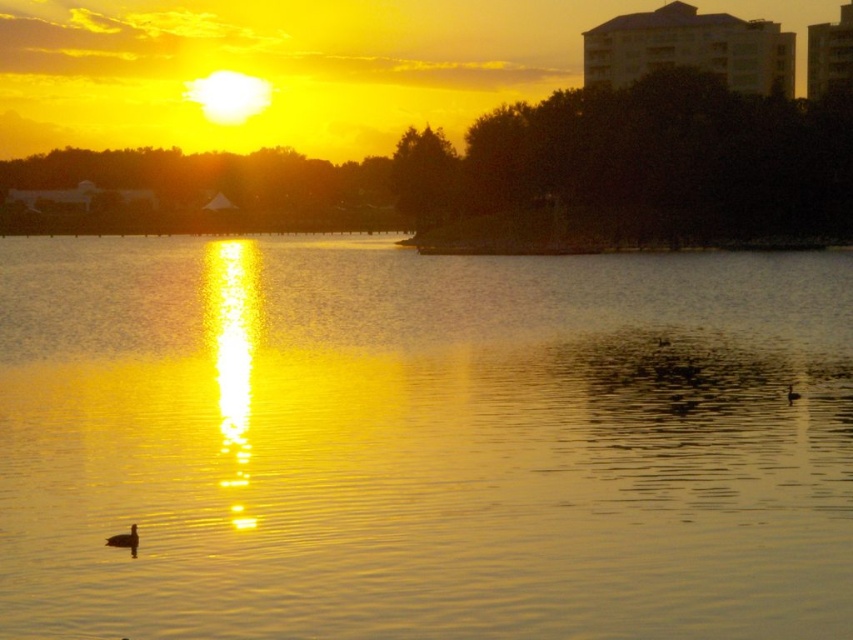
Who is positioned more to the left, golden reflective water at center or brown matte bird at lower right?

golden reflective water at center is more to the left.

Can you confirm if golden reflective water at center is positioned below brown matte bird at lower right?

No.

Which is behind, point (260, 288) or point (788, 387)?

The point (260, 288) is behind.

Locate an element on the screen. This screenshot has width=853, height=640. golden reflective water at center is located at coordinates (421, 442).

The image size is (853, 640). What do you see at coordinates (125, 540) in the screenshot?
I see `dark brown duck at lower left` at bounding box center [125, 540].

What do you see at coordinates (125, 540) in the screenshot? This screenshot has height=640, width=853. I see `dark brown duck at lower left` at bounding box center [125, 540].

Locate an element on the screen. dark brown duck at lower left is located at coordinates (125, 540).

Is golden reflective water at center shorter than dark brown duck at lower left?

Incorrect, golden reflective water at center's height does not fall short of dark brown duck at lower left's.

Locate an element on the screen. The height and width of the screenshot is (640, 853). golden reflective water at center is located at coordinates (421, 442).